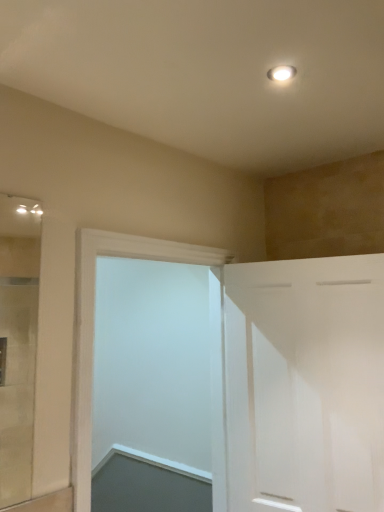
Identify the location of white matte cabinet at right, arranged as the first door when viewed from the right. (305, 384).

Describe the element at coordinates (305, 384) in the screenshot. I see `white matte cabinet at right, the 2th door from the left` at that location.

What is the approximate width of white matte cabinet at right, arranged as the first door when viewed from the right?

white matte cabinet at right, arranged as the first door when viewed from the right, is 5.12 inches wide.

You are a GUI agent. You are given a task and a screenshot of the screen. Output one action in this format:
    pyautogui.click(x=<x>, y=<y>)
    Task: Click on the white smooth door at center, acting as the first door starting from the left
    This screenshot has width=384, height=512.
    Given the screenshot: What is the action you would take?
    pyautogui.click(x=93, y=329)

What do you see at coordinates (93, 329) in the screenshot? The width and height of the screenshot is (384, 512). I see `white smooth door at center, the second door in the right-to-left sequence` at bounding box center [93, 329].

Find the location of a particular element. The height and width of the screenshot is (512, 384). white matte cabinet at right, arranged as the first door when viewed from the right is located at coordinates (305, 384).

Can you confirm if white smooth door at center, the second door in the right-to-left sequence, is positioned to the right of white matte cabinet at right, arranged as the first door when viewed from the right?

Incorrect, white smooth door at center, the second door in the right-to-left sequence, is not on the right side of white matte cabinet at right, arranged as the first door when viewed from the right.

Which object is further away from the camera taking this photo, white smooth door at center, acting as the first door starting from the left, or white matte cabinet at right, arranged as the first door when viewed from the right?

white matte cabinet at right, arranged as the first door when viewed from the right, is more distant.

Considering the positions of point (192, 252) and point (310, 506), is point (192, 252) closer or farther from the camera than point (310, 506)?

Point (192, 252).

From the image's perspective, is white smooth door at center, the second door in the right-to-left sequence, above white matte cabinet at right, arranged as the first door when viewed from the right?

Yes.

From a real-world perspective, is white smooth door at center, acting as the first door starting from the left, on white matte cabinet at right, arranged as the first door when viewed from the right?

Yes.

Considering the sizes of objects white smooth door at center, acting as the first door starting from the left, and white matte cabinet at right, arranged as the first door when viewed from the right, in the image provided, who is wider, white smooth door at center, acting as the first door starting from the left, or white matte cabinet at right, arranged as the first door when viewed from the right,?

white smooth door at center, acting as the first door starting from the left.

Considering the relative sizes of white smooth door at center, the second door in the right-to-left sequence, and white matte cabinet at right, arranged as the first door when viewed from the right, in the image provided, is white smooth door at center, the second door in the right-to-left sequence, shorter than white matte cabinet at right, arranged as the first door when viewed from the right,?

No, white smooth door at center, the second door in the right-to-left sequence, is not shorter than white matte cabinet at right, arranged as the first door when viewed from the right.

In the scene shown: In terms of size, does white smooth door at center, acting as the first door starting from the left, appear bigger or smaller than white matte cabinet at right, arranged as the first door when viewed from the right?

Considering their sizes, white smooth door at center, acting as the first door starting from the left, takes up more space than white matte cabinet at right, arranged as the first door when viewed from the right.

Would you say white smooth door at center, the second door in the right-to-left sequence, is inside or outside white matte cabinet at right, the 2th door from the left?

white smooth door at center, the second door in the right-to-left sequence, is spatially situated outside white matte cabinet at right, the 2th door from the left.

Are white smooth door at center, the second door in the right-to-left sequence, and white matte cabinet at right, the 2th door from the left, beside each other?

white smooth door at center, the second door in the right-to-left sequence, and white matte cabinet at right, the 2th door from the left, are clearly separated.

Could you tell me if white smooth door at center, the second door in the right-to-left sequence, is facing white matte cabinet at right, arranged as the first door when viewed from the right?

Yes, white smooth door at center, the second door in the right-to-left sequence, is aimed at white matte cabinet at right, arranged as the first door when viewed from the right.

Image resolution: width=384 pixels, height=512 pixels. In order to click on door that is on the right side of white smooth door at center, the second door in the right-to-left sequence in this screenshot , I will do `click(305, 384)`.

Considering the positions of objects white matte cabinet at right, the 2th door from the left, and white smooth door at center, the second door in the right-to-left sequence, in the image provided, who is more to the right, white matte cabinet at right, the 2th door from the left, or white smooth door at center, the second door in the right-to-left sequence,?

white matte cabinet at right, the 2th door from the left.

In the image, is white matte cabinet at right, the 2th door from the left, positioned in front of or behind white smooth door at center, the second door in the right-to-left sequence?

Clearly, white matte cabinet at right, the 2th door from the left, is behind white smooth door at center, the second door in the right-to-left sequence.

Which is in front, point (330, 309) or point (75, 352)?

The point (75, 352) is closer to the camera.

From the image's perspective, is white matte cabinet at right, arranged as the first door when viewed from the right, on white smooth door at center, acting as the first door starting from the left?

Incorrect, from the image's perspective, white matte cabinet at right, arranged as the first door when viewed from the right, is lower than white smooth door at center, acting as the first door starting from the left.

From a real-world perspective, is white matte cabinet at right, the 2th door from the left, under white smooth door at center, acting as the first door starting from the left?

Yes.

Is white matte cabinet at right, the 2th door from the left, wider or thinner than white smooth door at center, acting as the first door starting from the left?

Clearly, white matte cabinet at right, the 2th door from the left, has less width compared to white smooth door at center, acting as the first door starting from the left.

From their relative heights in the image, would you say white matte cabinet at right, arranged as the first door when viewed from the right, is taller or shorter than white smooth door at center, acting as the first door starting from the left?

white matte cabinet at right, arranged as the first door when viewed from the right, is shorter than white smooth door at center, acting as the first door starting from the left.

Consider the image. Considering the relative sizes of white matte cabinet at right, the 2th door from the left, and white smooth door at center, the second door in the right-to-left sequence, in the image provided, is white matte cabinet at right, the 2th door from the left, smaller than white smooth door at center, the second door in the right-to-left sequence,?

Yes.

Would you say white matte cabinet at right, arranged as the first door when viewed from the right, is inside or outside white smooth door at center, the second door in the right-to-left sequence?

white matte cabinet at right, arranged as the first door when viewed from the right, is outside white smooth door at center, the second door in the right-to-left sequence.

Based on the photo, is white matte cabinet at right, the 2th door from the left, directly adjacent to white smooth door at center, the second door in the right-to-left sequence?

There is a gap between white matte cabinet at right, the 2th door from the left, and white smooth door at center, the second door in the right-to-left sequence.

Is white matte cabinet at right, arranged as the first door when viewed from the right, turned away from white smooth door at center, the second door in the right-to-left sequence?

No.

Can you tell me how much white matte cabinet at right, the 2th door from the left, and white smooth door at center, the second door in the right-to-left sequence, differ in facing direction?

There is a 79.1-degree angle between the facing directions of white matte cabinet at right, the 2th door from the left, and white smooth door at center, the second door in the right-to-left sequence.

Identify the location of door positioned vertically above the white matte cabinet at right, the 2th door from the left (from a real-world perspective). (93, 329).

Locate an element on the screen. door on the left of white matte cabinet at right, the 2th door from the left is located at coordinates (93, 329).

Find the location of `door on the right of white smooth door at center, acting as the first door starting from the left`. door on the right of white smooth door at center, acting as the first door starting from the left is located at coordinates (305, 384).